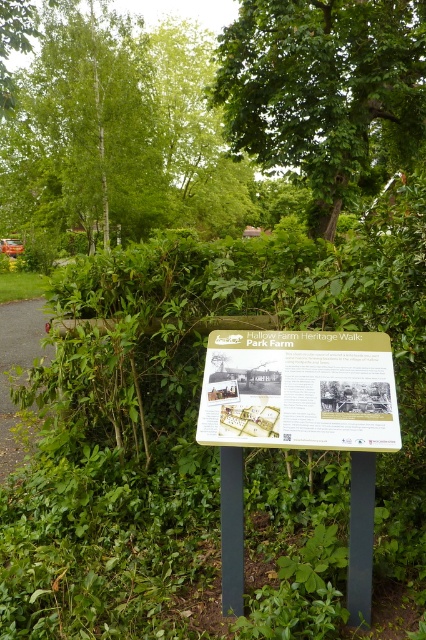
Question: Does birch bark tree at left appear on the right side of gravel path at left?

Choices:
 (A) yes
 (B) no

Answer: (B)

Question: Among these objects, which one is farthest from the camera?

Choices:
 (A) birch bark tree at left
 (B) wooden signboard at center

Answer: (A)

Question: Which object appears closest to the camera in this image?

Choices:
 (A) wooden signboard at center
 (B) gravel path at left

Answer: (A)

Question: Among these points, which one is farthest from the camera?

Choices:
 (A) (81, 166)
 (B) (11, 305)

Answer: (A)

Question: Does birch bark tree at left have a larger size compared to gravel path at left?

Choices:
 (A) no
 (B) yes

Answer: (B)

Question: Is birch bark tree at left positioned at the back of gravel path at left?

Choices:
 (A) yes
 (B) no

Answer: (A)